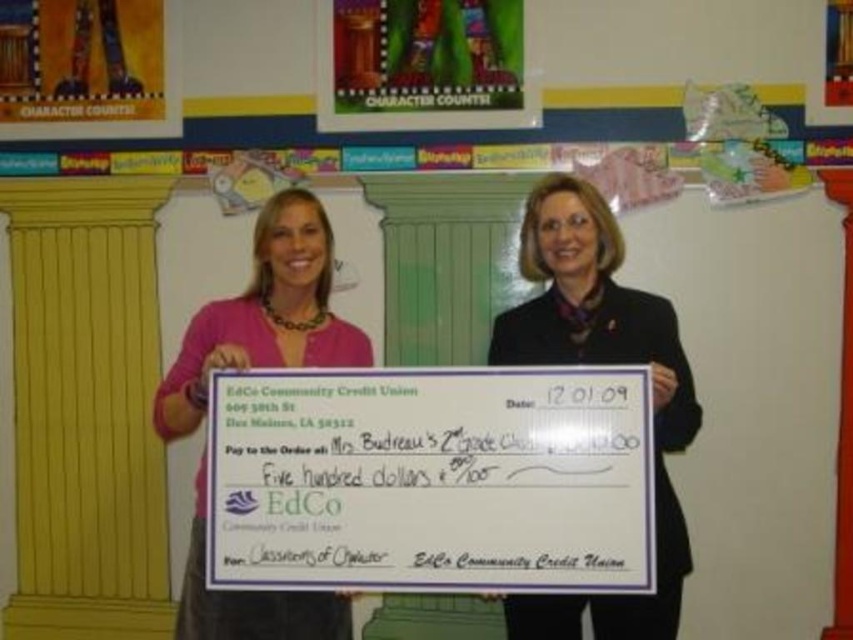
Question: Can you confirm if black fabric coat at center is positioned above pink fabric shirt at center?

Choices:
 (A) no
 (B) yes

Answer: (A)

Question: Does black fabric coat at center have a greater width compared to pink fabric shirt at center?

Choices:
 (A) no
 (B) yes

Answer: (A)

Question: Is black fabric coat at center below pink fabric shirt at center?

Choices:
 (A) yes
 (B) no

Answer: (A)